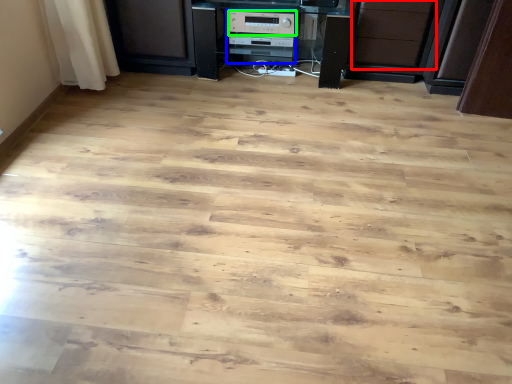
Question: Which object is the farthest from drawer (highlighted by a red box)? Choose among these: appliance (highlighted by a blue box) or appliance (highlighted by a green box).

Choices:
 (A) appliance
 (B) appliance

Answer: (B)